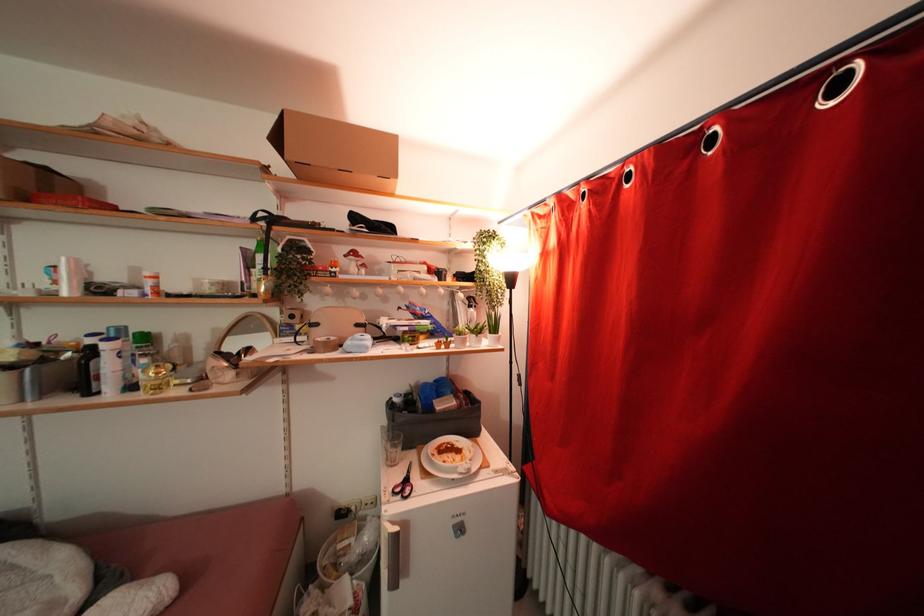
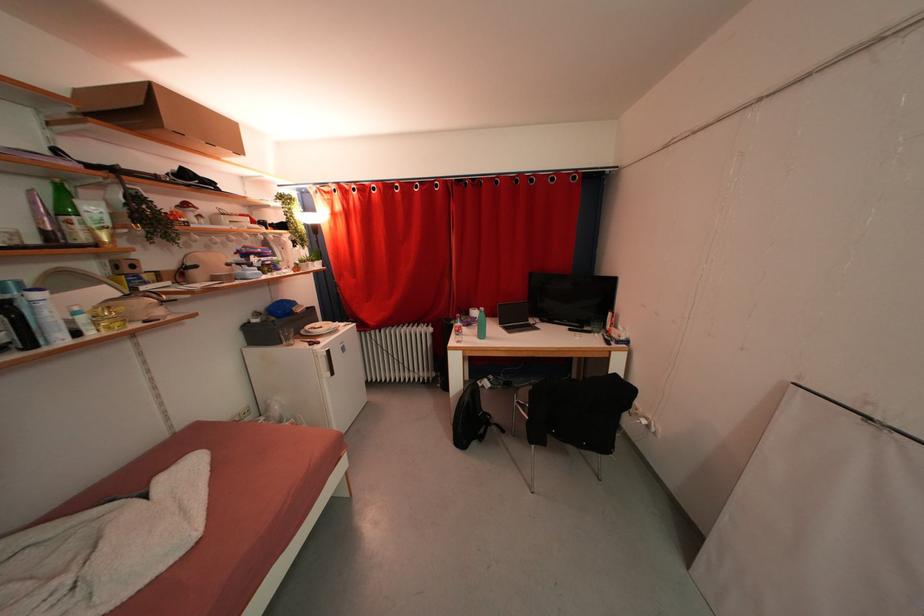
Locate, in the second image, the point that corresponds to point 264,292 in the first image.

(102, 241)